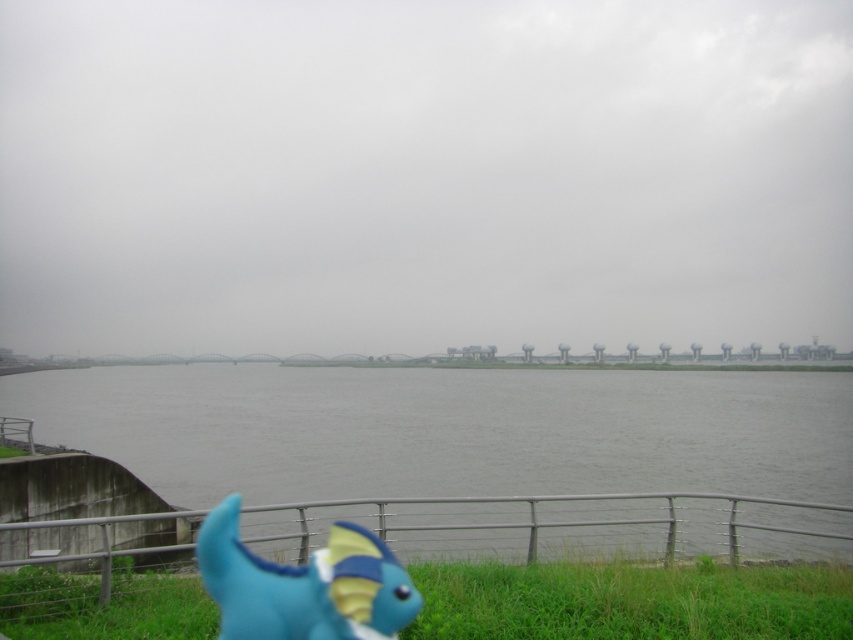
From the picture: Can you confirm if gray concrete lake at center is taller than blue rubber toy at lower left?

Answer: No, gray concrete lake at center is not taller than blue rubber toy at lower left.

Who is more distant from viewer, [761,461] or [350,557]?

The point [761,461] is more distant.

Where is `gray concrete lake at center`? The image size is (853, 640). gray concrete lake at center is located at coordinates (448, 429).

Who is more forward, [515,605] or [380,634]?

Point [380,634] is in front.

Locate an element on the screen. Image resolution: width=853 pixels, height=640 pixels. green grass at lower center is located at coordinates (631, 600).

Who is positioned more to the left, gray concrete lake at center or green grass at lower center?

From the viewer's perspective, gray concrete lake at center appears more on the left side.

Does gray concrete lake at center lie in front of green grass at lower center?

No, it is behind green grass at lower center.

At what (x,y) coordinates should I click in order to perform the action: click on gray concrete lake at center. Please return your answer as a coordinate pair (x, y). The image size is (853, 640). Looking at the image, I should click on (448, 429).

At what (x,y) coordinates should I click in order to perform the action: click on gray concrete lake at center. Please return your answer as a coordinate pair (x, y). Looking at the image, I should click on (448, 429).